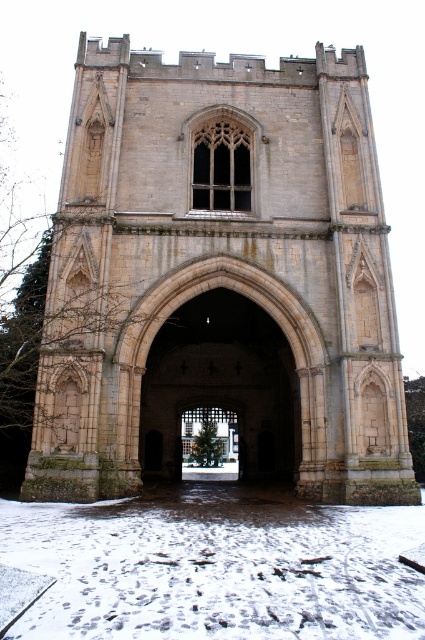
Question: Which of these objects is positioned farthest from the green matte christmas tree at center?

Choices:
 (A) light brown stone church at center
 (B) white powdery snow at lower center

Answer: (B)

Question: Where is light brown stone church at center located in relation to green matte christmas tree at center in the image?

Choices:
 (A) above
 (B) below

Answer: (A)

Question: Which point appears closest to the camera in this image?

Choices:
 (A) (141, 589)
 (B) (189, 428)
 (C) (119, 202)

Answer: (A)

Question: Does light brown stone church at center appear on the left side of green matte christmas tree at center?

Choices:
 (A) yes
 (B) no

Answer: (B)

Question: Is light brown stone church at center positioned before green matte christmas tree at center?

Choices:
 (A) no
 (B) yes

Answer: (B)

Question: Among these points, which one is farthest from the camera?

Choices:
 (A) (189, 456)
 (B) (96, 509)

Answer: (A)